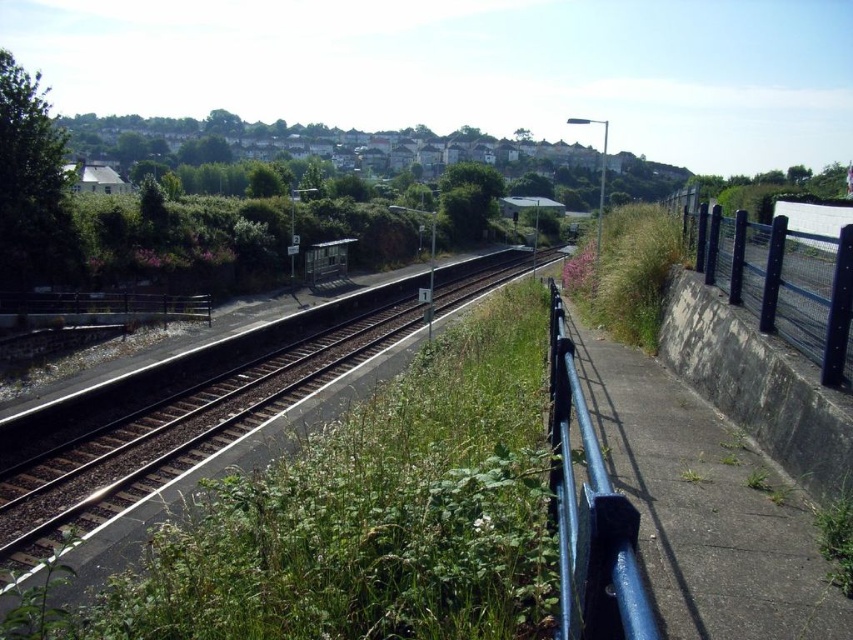
Question: Considering the relative positions of brown wooden train track at center and black metal fence at right in the image provided, where is brown wooden train track at center located with respect to black metal fence at right?

Choices:
 (A) left
 (B) right

Answer: (A)

Question: Which is farther from the brown wooden train track at center?

Choices:
 (A) blue metallic rail at right
 (B) black metal fence at right

Answer: (A)

Question: Which object is positioned farthest from the blue metallic rail at right?

Choices:
 (A) black metal fence at right
 (B) brown wooden train track at center

Answer: (B)

Question: Among these points, which one is nearest to the camera?

Choices:
 (A) (593, 605)
 (B) (770, 252)

Answer: (A)

Question: Does brown wooden train track at center appear on the left side of black metal fence at right?

Choices:
 (A) no
 (B) yes

Answer: (B)

Question: Does brown wooden train track at center appear under blue metallic rail at right?

Choices:
 (A) yes
 (B) no

Answer: (B)